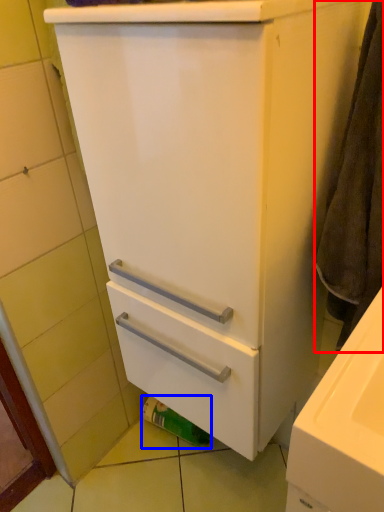
Question: Which object is further to the camera taking this photo, bath towel (highlighted by a red box) or toilet paper (highlighted by a blue box)?

Choices:
 (A) bath towel
 (B) toilet paper

Answer: (B)